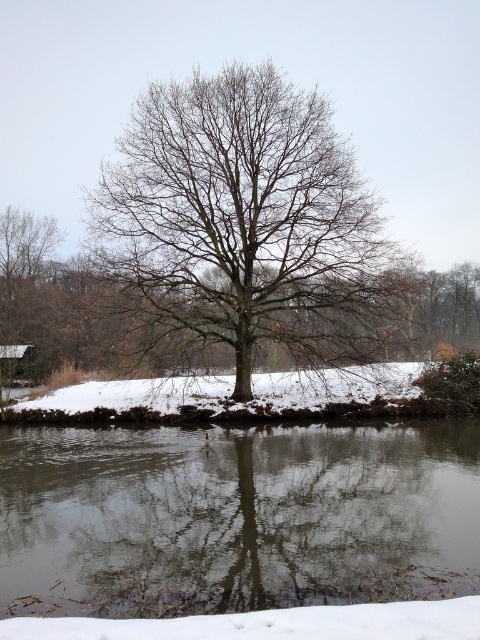
Describe the element at coordinates (236, 516) in the screenshot. I see `transparent ice at center` at that location.

Between point (52, 602) and point (346, 145), which one is positioned behind?

The point (346, 145) is behind.

The image size is (480, 640). In order to click on transparent ice at center in this screenshot , I will do `click(236, 516)`.